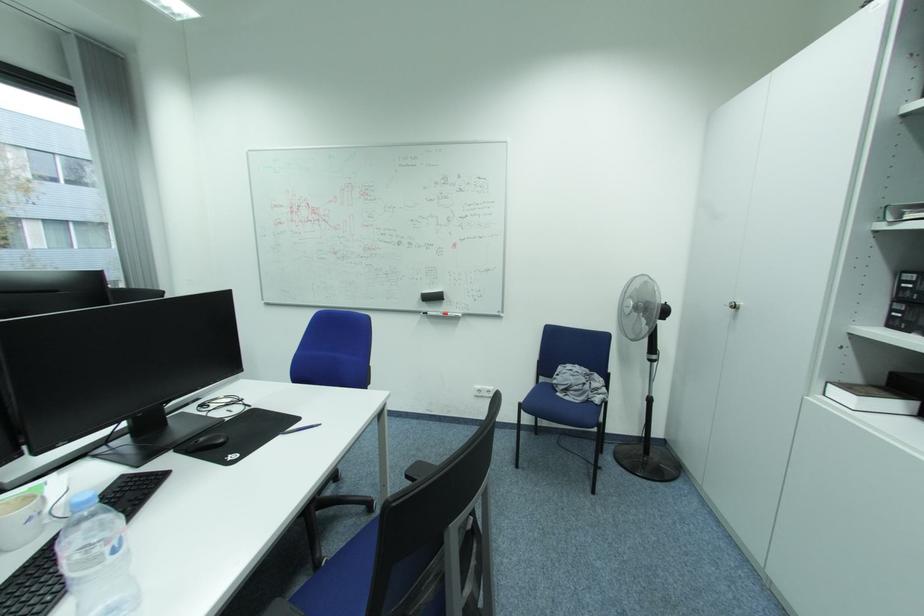
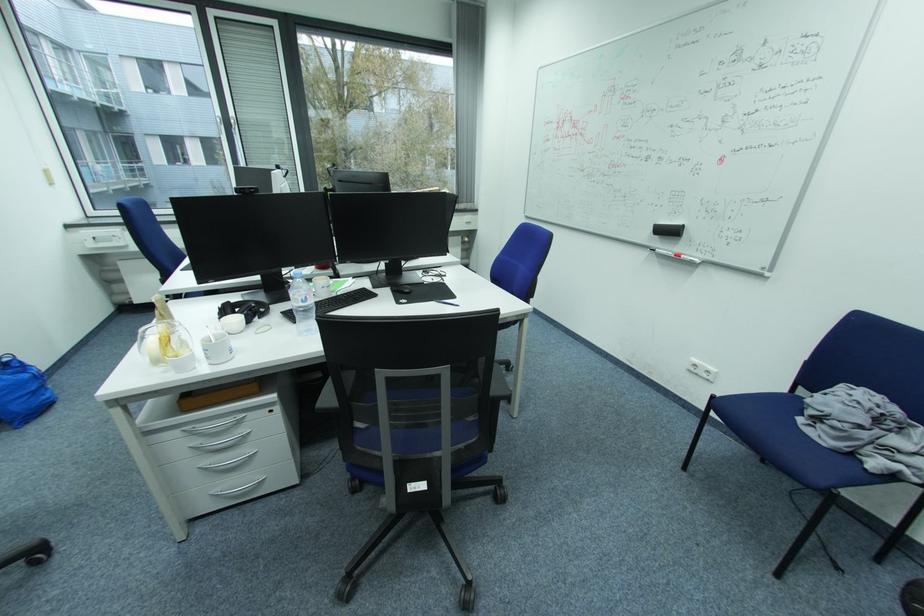
In the second image, find the point that corresponds to point (544, 435) in the first image.

(772, 463)